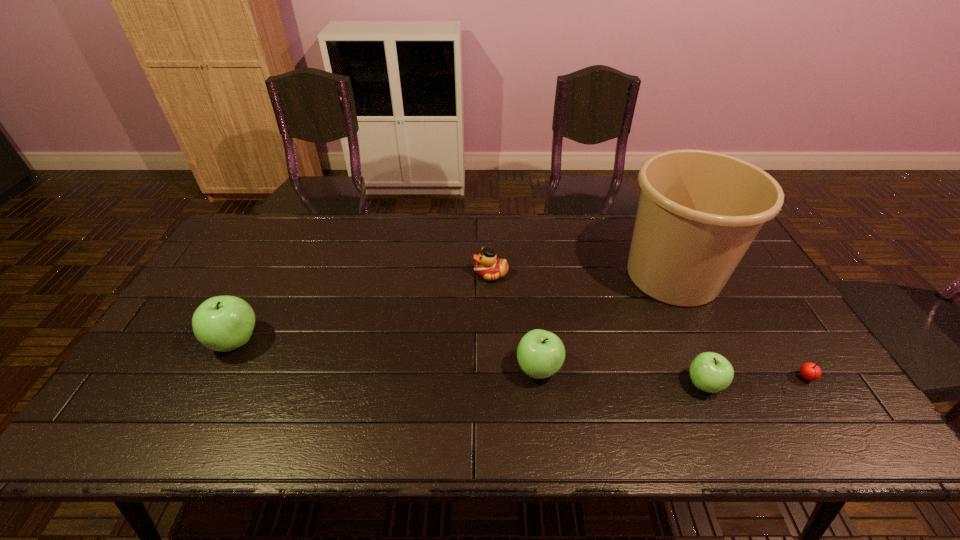
If the aim is uniform spacing by inserting an additional apple among them, please point to a vacant space for this new apple. Please provide its 2D coordinates. Your answer should be formatted as a tuple, i.e. [(x, y)], where the tuple contains the x and y coordinates of a point satisfying the conditions above.

[(383, 355)]